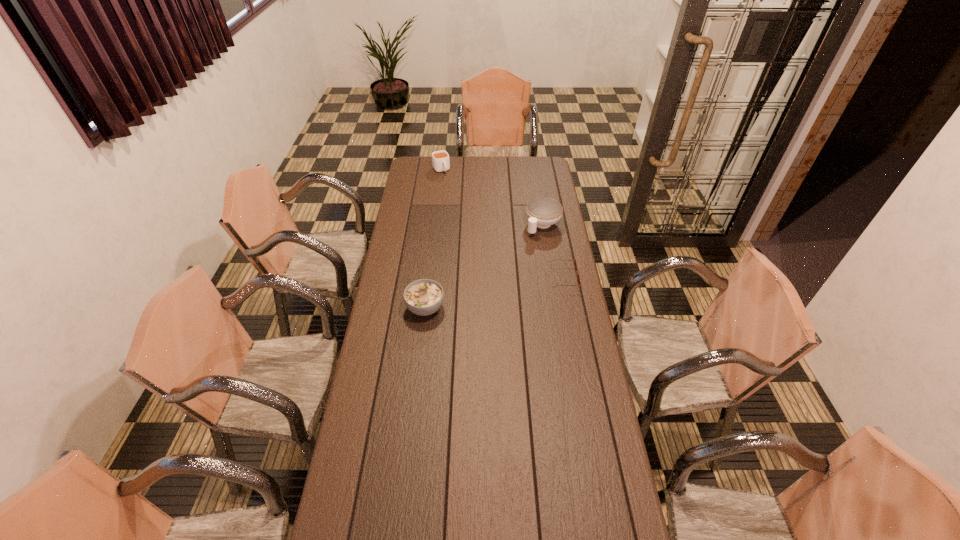
Identify the location of free space on the desktop that is between the soup bowl and the sunglasses and is positioned on the side with the handle of the chinaware. This screenshot has width=960, height=540. (477, 296).

Find the location of a particular element. The image size is (960, 540). vacant space on the desktop that is between the nearest object and the shortest object and is positioned on the side with the handle of the cup is located at coordinates coord(516,287).